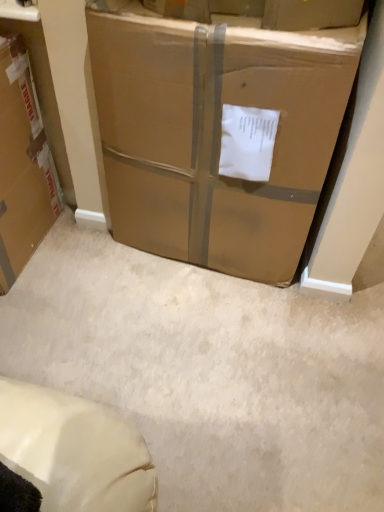
Question: Is brown cardboard box at center, which is the 1th box in right-to-left order, located outside brown cardboard box at left, placed as the first box when sorted from left to right?

Choices:
 (A) no
 (B) yes

Answer: (B)

Question: Does brown cardboard box at center, the 2th box in the left-to-right sequence, have a greater height compared to brown cardboard box at left, placed as the 2th box when sorted from right to left?

Choices:
 (A) yes
 (B) no

Answer: (A)

Question: Does brown cardboard box at center, which is the 1th box in right-to-left order, have a greater width compared to brown cardboard box at left, placed as the first box when sorted from left to right?

Choices:
 (A) yes
 (B) no

Answer: (B)

Question: From the image's perspective, would you say brown cardboard box at center, which is the 1th box in right-to-left order, is positioned over brown cardboard box at left, placed as the 2th box when sorted from right to left?

Choices:
 (A) yes
 (B) no

Answer: (A)

Question: Is brown cardboard box at center, the 2th box in the left-to-right sequence, oriented away from brown cardboard box at left, placed as the first box when sorted from left to right?

Choices:
 (A) yes
 (B) no

Answer: (B)

Question: Is brown cardboard box at center, which is the 1th box in right-to-left order, far away from brown cardboard box at left, placed as the first box when sorted from left to right?

Choices:
 (A) no
 (B) yes

Answer: (A)

Question: Does brown cardboard box at left, placed as the first box when sorted from left to right, appear on the left side of brown cardboard box at center, the 2th box in the left-to-right sequence?

Choices:
 (A) no
 (B) yes

Answer: (B)

Question: Is brown cardboard box at left, placed as the 2th box when sorted from right to left, not near brown cardboard box at center, which is the 1th box in right-to-left order?

Choices:
 (A) yes
 (B) no

Answer: (B)

Question: Does brown cardboard box at left, placed as the first box when sorted from left to right, have a lesser height compared to brown cardboard box at center, the 2th box in the left-to-right sequence?

Choices:
 (A) yes
 (B) no

Answer: (A)

Question: Is brown cardboard box at left, placed as the first box when sorted from left to right, positioned in front of brown cardboard box at center, the 2th box in the left-to-right sequence?

Choices:
 (A) no
 (B) yes

Answer: (A)

Question: Is the surface of brown cardboard box at left, placed as the first box when sorted from left to right, in direct contact with brown cardboard box at center, the 2th box in the left-to-right sequence?

Choices:
 (A) no
 (B) yes

Answer: (A)

Question: From a real-world perspective, is brown cardboard box at left, placed as the 2th box when sorted from right to left, on top of brown cardboard box at center, which is the 1th box in right-to-left order?

Choices:
 (A) yes
 (B) no

Answer: (B)

Question: Based on their sizes in the image, would you say brown cardboard box at left, placed as the first box when sorted from left to right, is bigger or smaller than brown cardboard box at center, the 2th box in the left-to-right sequence?

Choices:
 (A) big
 (B) small

Answer: (B)